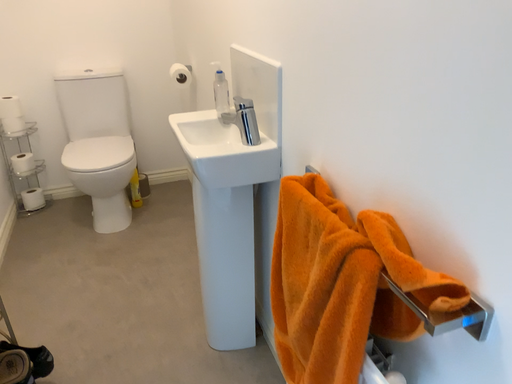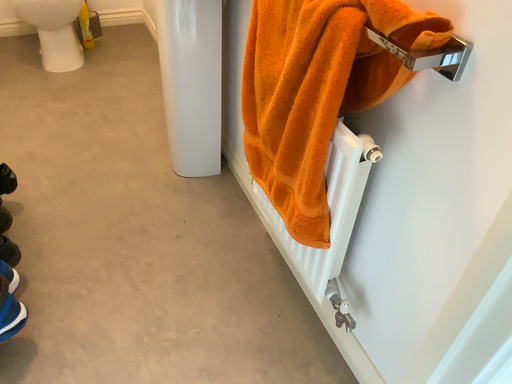
Question: How did the camera likely rotate when shooting the video?

Choices:
 (A) rotated downward
 (B) rotated upward

Answer: (A)